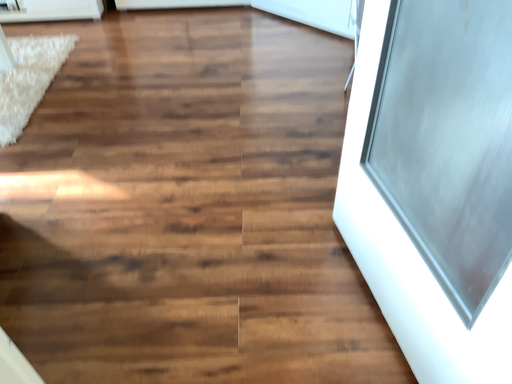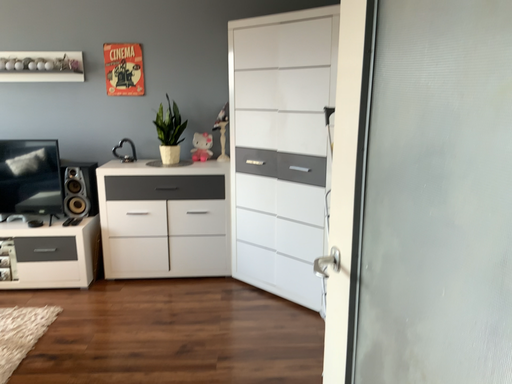
Question: How did the camera likely rotate when shooting the video?

Choices:
 (A) rotated downward
 (B) rotated upward

Answer: (B)